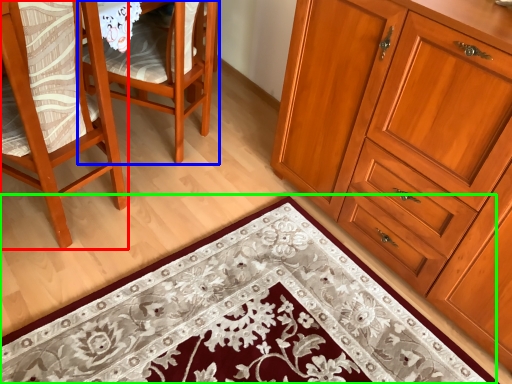
Question: Estimate the real-world distances between objects in this image. Which object is closer to chair (highlighted by a red box), chair (highlighted by a blue box) or doormat (highlighted by a green box)?

Choices:
 (A) chair
 (B) doormat

Answer: (A)